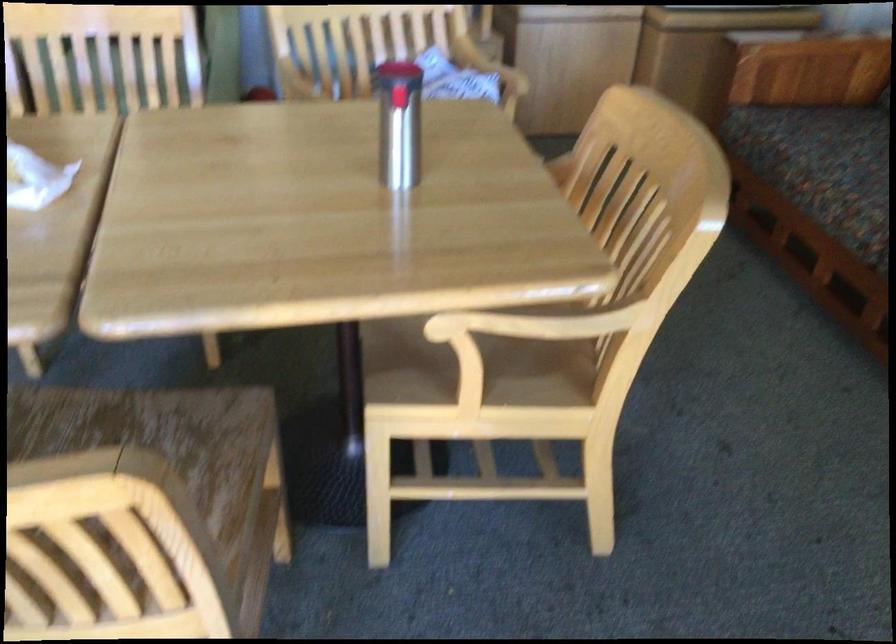
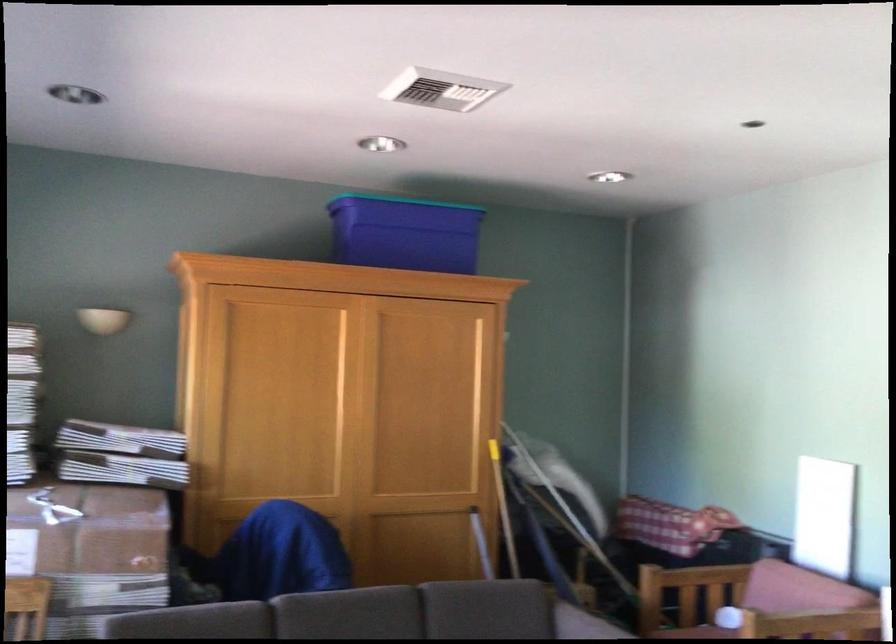
Question: The camera is either moving clockwise (left) or counter-clockwise (right) around the object. The first image is from the beginning of the video and the second image is from the end. Is the camera moving left or right when shooting the video?

Choices:
 (A) Left
 (B) Right

Answer: (B)